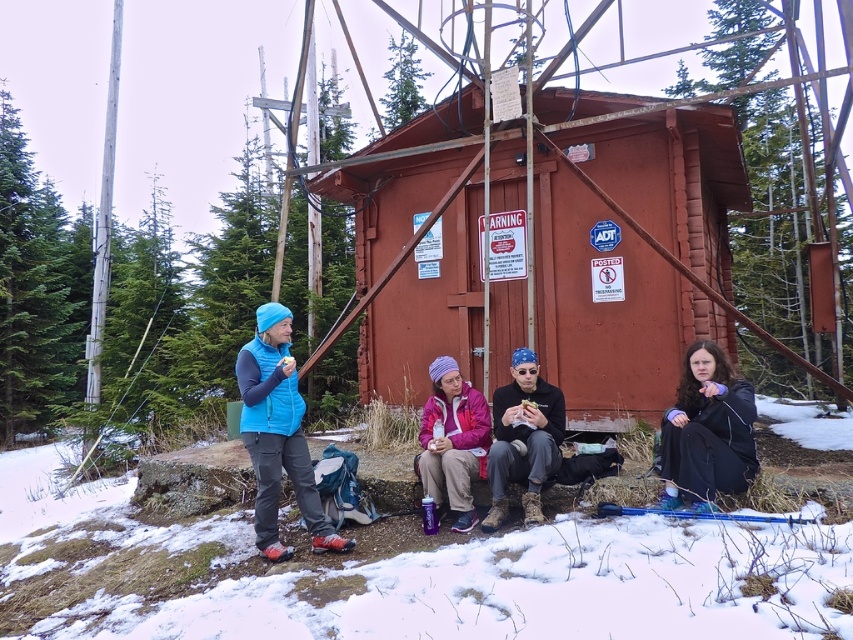
Question: Among these points, which one is nearest to the camera?

Choices:
 (A) (160, 545)
 (B) (747, 467)
 (C) (549, 456)
 (D) (664, 328)

Answer: (B)

Question: Does blue fleece vest at center lie in front of purple fleece jacket at lower right?

Choices:
 (A) yes
 (B) no

Answer: (B)

Question: Based on their relative distances, which object is nearer to the blue fleece vest at center?

Choices:
 (A) purple fleece jacket at center
 (B) purple fleece jacket at lower right

Answer: (A)

Question: Which of the following is the closest to the observer?

Choices:
 (A) (258, 381)
 (B) (473, 429)
 (C) (376, 196)
 (D) (730, 413)

Answer: (D)

Question: Does blue fleece vest at center appear over purple fleece jacket at lower right?

Choices:
 (A) no
 (B) yes

Answer: (A)

Question: Does blue fleece vest at center come in front of purple fleece jacket at lower right?

Choices:
 (A) yes
 (B) no

Answer: (B)